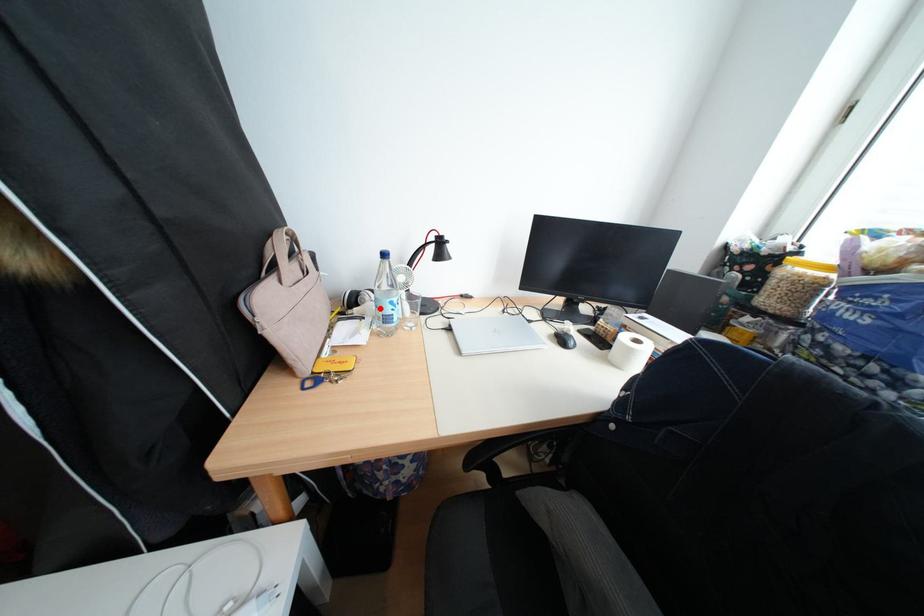
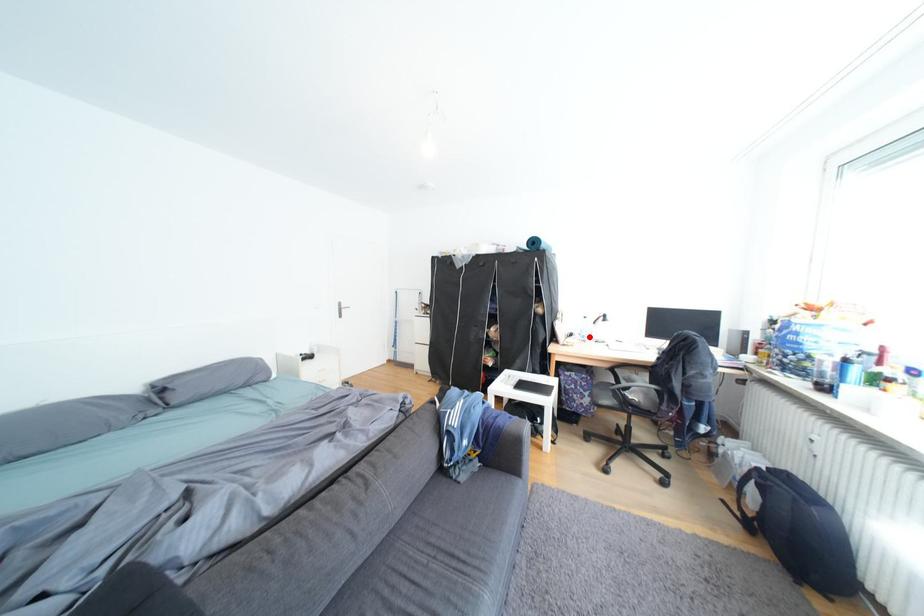
I am providing you with two images of the same scene from different viewpoints. A red point is marked on the first image and another point is marked on the second image. Does the point marked in image1 correspond to the same location as the one in image2?

Yes